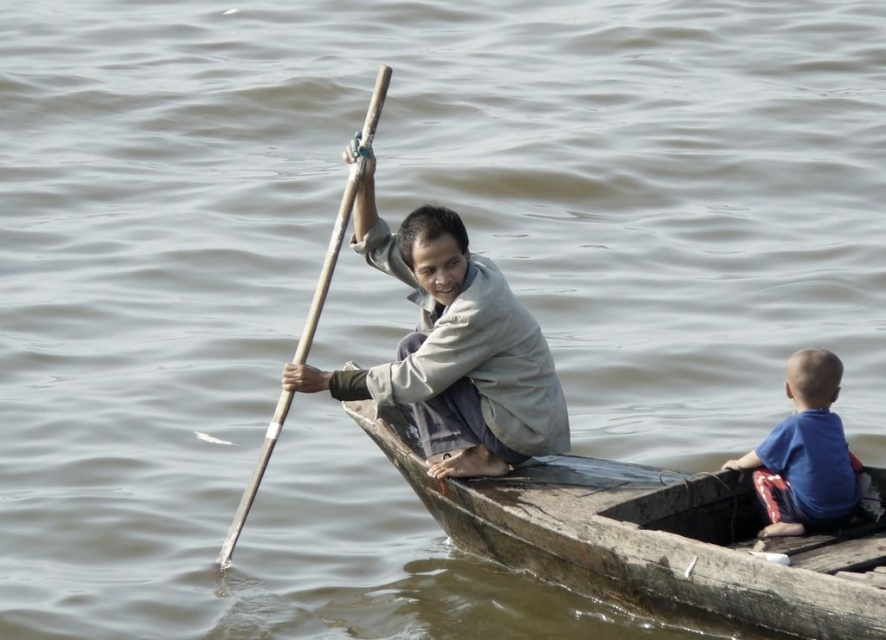
Which of these two, wooden boat at center or wooden smooth paddle at center, stands taller?

Standing taller between the two is wooden smooth paddle at center.

Who is more distant from viewer, (x=815, y=616) or (x=305, y=348)?

Point (x=305, y=348)

At what (x,y) coordinates should I click in order to perform the action: click on wooden boat at center. Please return your answer as a coordinate pair (x, y). The height and width of the screenshot is (640, 886). Looking at the image, I should click on (654, 540).

Can you confirm if wooden boat at center is positioned to the left of blue cotton shirt at upper center?

Incorrect, wooden boat at center is not on the left side of blue cotton shirt at upper center.

Is wooden boat at center positioned in front of blue cotton shirt at upper center?

Yes, it is in front of blue cotton shirt at upper center.

Locate an element on the screen. The image size is (886, 640). wooden boat at center is located at coordinates (654, 540).

Does wooden boat at center have a greater width compared to blue cotton shirt at right?

Yes, wooden boat at center is wider than blue cotton shirt at right.

Does wooden boat at center have a lesser height compared to blue cotton shirt at right?

No, wooden boat at center is not shorter than blue cotton shirt at right.

What do you see at coordinates (654, 540) in the screenshot? Image resolution: width=886 pixels, height=640 pixels. I see `wooden boat at center` at bounding box center [654, 540].

Locate an element on the screen. wooden boat at center is located at coordinates (654, 540).